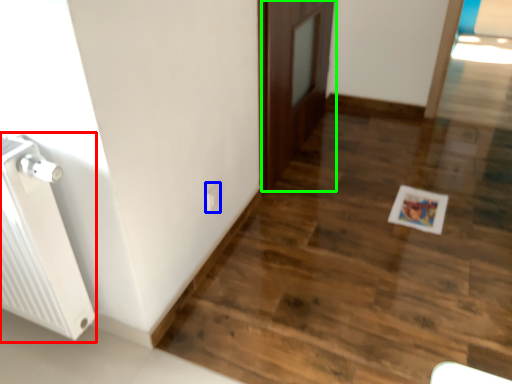
Question: Estimate the real-world distances between objects in this image. Which object is closer to radiator (highlighted by a red box), electric outlet (highlighted by a blue box) or door (highlighted by a green box)?

Choices:
 (A) electric outlet
 (B) door

Answer: (A)